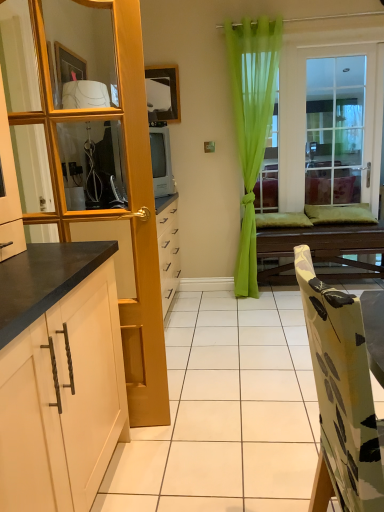
Question: From the image's perspective, is clear glass window at center located beneath clear glass mirror at upper left?

Choices:
 (A) yes
 (B) no

Answer: (B)

Question: From a real-world perspective, is clear glass window at center positioned over clear glass mirror at upper left based on gravity?

Choices:
 (A) no
 (B) yes

Answer: (A)

Question: Can you confirm if clear glass window at center is wider than clear glass mirror at upper left?

Choices:
 (A) no
 (B) yes

Answer: (A)

Question: Is the surface of clear glass window at center in direct contact with clear glass mirror at upper left?

Choices:
 (A) no
 (B) yes

Answer: (A)

Question: Can you confirm if clear glass window at center is shorter than clear glass mirror at upper left?

Choices:
 (A) yes
 (B) no

Answer: (B)

Question: Looking at the image, does white matte cabinet at left seem bigger or smaller compared to green sheer curtain at center?

Choices:
 (A) small
 (B) big

Answer: (A)

Question: Is white matte cabinet at left wider or thinner than green sheer curtain at center?

Choices:
 (A) thin
 (B) wide

Answer: (A)

Question: Is white matte cabinet at left taller or shorter than green sheer curtain at center?

Choices:
 (A) tall
 (B) short

Answer: (B)

Question: From the image's perspective, is white matte cabinet at left positioned above or below green sheer curtain at center?

Choices:
 (A) above
 (B) below

Answer: (B)

Question: From their relative heights in the image, would you say clear glass mirror at upper left is taller or shorter than clear glass window at center?

Choices:
 (A) short
 (B) tall

Answer: (A)

Question: Considering the positions of clear glass mirror at upper left and clear glass window at center in the image, is clear glass mirror at upper left bigger or smaller than clear glass window at center?

Choices:
 (A) big
 (B) small

Answer: (B)

Question: Is point (69, 176) closer or farther from the camera than point (324, 110)?

Choices:
 (A) closer
 (B) farther

Answer: (A)

Question: In the image, is clear glass mirror at upper left positioned in front of or behind clear glass window at center?

Choices:
 (A) behind
 (B) front

Answer: (B)

Question: Is clear glass window at center in front of or behind green sheer curtain at center in the image?

Choices:
 (A) front
 (B) behind

Answer: (B)

Question: From a real-world perspective, is clear glass window at center above or below green sheer curtain at center?

Choices:
 (A) above
 (B) below

Answer: (B)